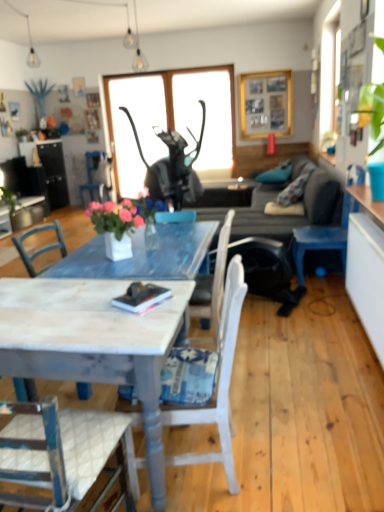
What are the coordinates of `free point above white painted wood desk at center (from a real-world perspective)` in the screenshot? It's located at (69, 300).